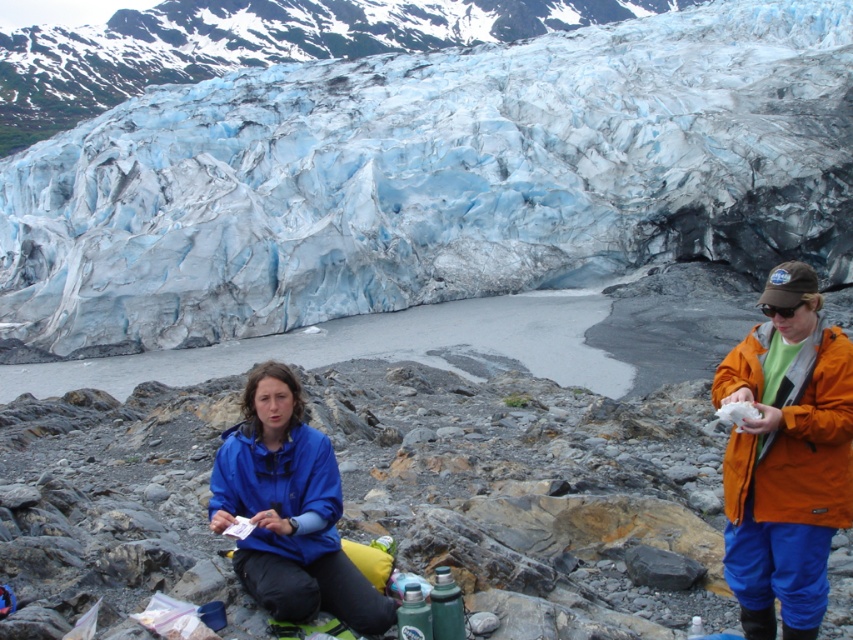
Can you confirm if blue ice glacier at center is wider than blue matte jacket at lower center?

Correct, the width of blue ice glacier at center exceeds that of blue matte jacket at lower center.

Measure the distance from blue ice glacier at center to blue matte jacket at lower center.

blue ice glacier at center is 60.23 meters away from blue matte jacket at lower center.

Describe the element at coordinates (437, 177) in the screenshot. I see `blue ice glacier at center` at that location.

The height and width of the screenshot is (640, 853). Find the location of `blue ice glacier at center`. blue ice glacier at center is located at coordinates (437, 177).